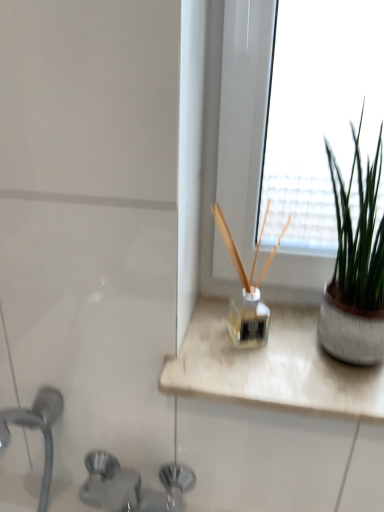
At what (x,y) coordinates should I click in order to perform the action: click on brushed metal faucet at lower left. Please return your answer as a coordinate pair (x, y). Looking at the image, I should click on (127, 487).

What do you see at coordinates (127, 487) in the screenshot? I see `brushed metal faucet at lower left` at bounding box center [127, 487].

What is the approximate height of green matte plant at right?

green matte plant at right is 14.78 inches in height.

Locate an element on the screen. green matte plant at right is located at coordinates (355, 268).

Describe the element at coordinates (355, 268) in the screenshot. I see `green matte plant at right` at that location.

Locate an element on the screen. brushed metal faucet at lower left is located at coordinates (127, 487).

Is brushed metal faucet at lower left at the left side of green matte plant at right?

Yes.

Is the position of brushed metal faucet at lower left more distant than that of green matte plant at right?

No, brushed metal faucet at lower left is closer to the viewer.

Which is closer to the camera, (43, 500) or (329, 348)?

Clearly, point (43, 500) is more distant from the camera than point (329, 348).

From the image's perspective, is brushed metal faucet at lower left beneath green matte plant at right?

Yes, from the image's perspective, brushed metal faucet at lower left is below green matte plant at right.

From a real-world perspective, does brushed metal faucet at lower left stand above green matte plant at right?

Incorrect, from a real-world perspective, brushed metal faucet at lower left is lower than green matte plant at right.

Considering the relative sizes of brushed metal faucet at lower left and green matte plant at right in the image provided, is brushed metal faucet at lower left wider than green matte plant at right?

Correct, the width of brushed metal faucet at lower left exceeds that of green matte plant at right.

From their relative heights in the image, would you say brushed metal faucet at lower left is taller or shorter than green matte plant at right?

Considering their sizes, brushed metal faucet at lower left has more height than green matte plant at right.

Which of these two, brushed metal faucet at lower left or green matte plant at right, is bigger?

brushed metal faucet at lower left.

Which is correct: brushed metal faucet at lower left is inside green matte plant at right, or outside of it?

brushed metal faucet at lower left lies outside green matte plant at right.

Is brushed metal faucet at lower left positioned far away from green matte plant at right?

That's not correct — brushed metal faucet at lower left is a little close to green matte plant at right.

Is brushed metal faucet at lower left facing away from green matte plant at right?

brushed metal faucet at lower left is not turned away from green matte plant at right.

How much distance is there between brushed metal faucet at lower left and green matte plant at right?

brushed metal faucet at lower left and green matte plant at right are 19.55 inches apart.

Locate an element on the screen. sink below the green matte plant at right (from the image's perspective) is located at coordinates [127, 487].

Is green matte plant at right at the left side of brushed metal faucet at lower left?

No.

Considering the positions of objects green matte plant at right and brushed metal faucet at lower left in the image provided, who is in front, green matte plant at right or brushed metal faucet at lower left?

Positioned in front is brushed metal faucet at lower left.

Is point (331, 341) more distant than point (7, 445)?

That is False.

From the image's perspective, is green matte plant at right above brushed metal faucet at lower left?

Correct, green matte plant at right appears higher than brushed metal faucet at lower left in the image.

From a real-world perspective, between green matte plant at right and brushed metal faucet at lower left, who is vertically higher?

In real-world perspective, green matte plant at right is above.

Considering the sizes of green matte plant at right and brushed metal faucet at lower left in the image, is green matte plant at right wider or thinner than brushed metal faucet at lower left?

In the image, green matte plant at right appears to be more narrow than brushed metal faucet at lower left.

Is green matte plant at right taller than brushed metal faucet at lower left?

No, green matte plant at right is not taller than brushed metal faucet at lower left.

Based on the photo, which of these two, green matte plant at right or brushed metal faucet at lower left, is bigger?

brushed metal faucet at lower left is bigger.

Is brushed metal faucet at lower left surrounded by green matte plant at right?

Actually, brushed metal faucet at lower left is outside green matte plant at right.

Can you see green matte plant at right touching brushed metal faucet at lower left?

No.

Is green matte plant at right facing away from brushed metal faucet at lower left?

No, green matte plant at right is not facing the opposite direction of brushed metal faucet at lower left.

How many degrees apart are the facing directions of green matte plant at right and brushed metal faucet at lower left?

The angle between the facing direction of green matte plant at right and the facing direction of brushed metal faucet at lower left is 2.52 degrees.

Identify the location of sink that appears in front of the green matte plant at right. (127, 487).

What are the coordinates of `sink that is on the left side of green matte plant at right` in the screenshot? It's located at (127, 487).

Locate an element on the screen. The height and width of the screenshot is (512, 384). sink below the green matte plant at right (from a real-world perspective) is located at coordinates (127, 487).